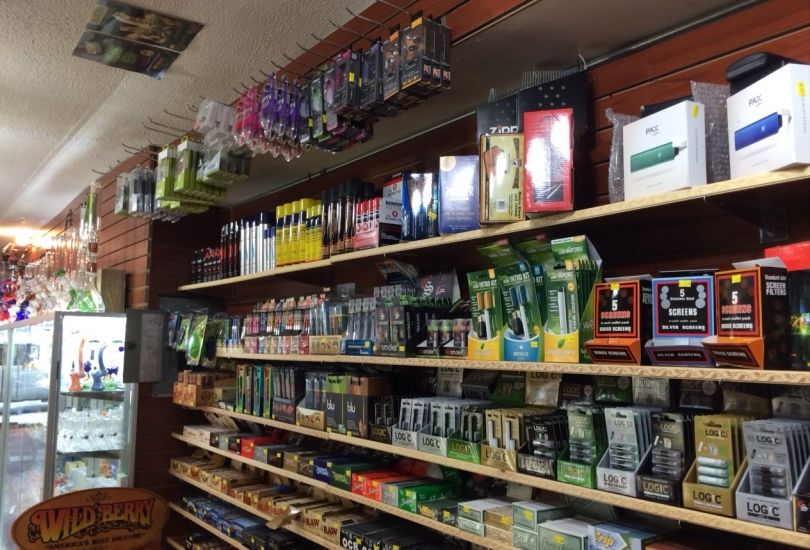
Image resolution: width=810 pixels, height=550 pixels. In order to click on stand in this screenshot , I will do `click(87, 422)`.